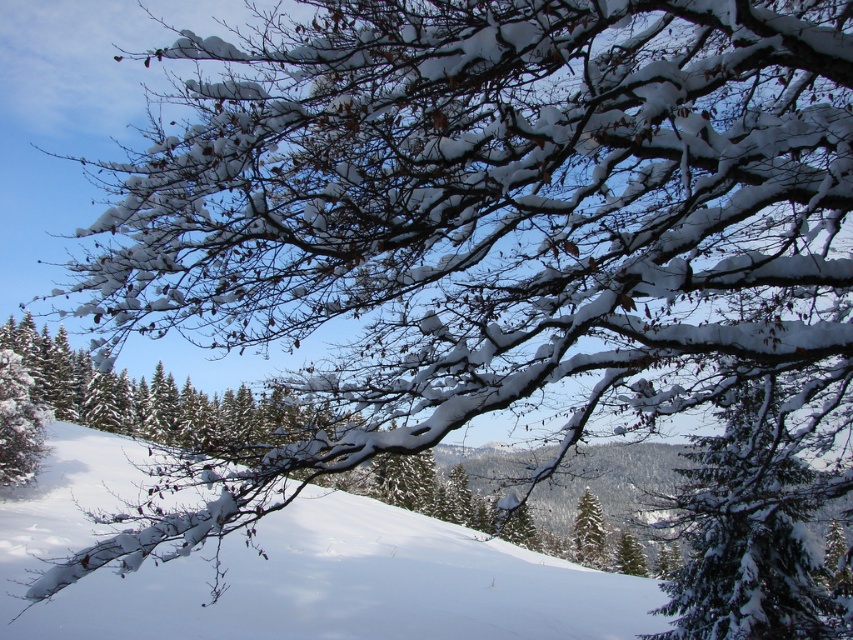
You are an observer standing in the winter landscape. You notice the white snow at center and the green matte tree at center. Which object is closer to you?

The white snow at center is closer to you because it is positioned in front of the green matte tree at center.

You are standing in the winter landscape looking at the snow covered tree branch. There are two points marked on the image, point A at coordinates point (749,387) and point B at coordinates point (587,504). Which point is closer to you?

Point point (749,387) is closer to the viewer than point point (587,504).